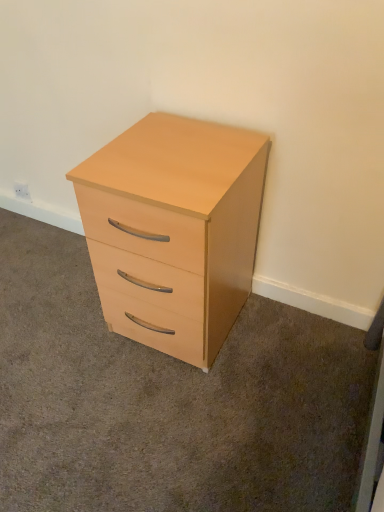
In order to face white plastic electric outlet at upper left, should I rotate leftwards or rightwards?

You should rotate left by 21.976 degrees.

Based on the photo, measure the distance between point (20, 195) and camera.

They are 2.01 meters apart.

Locate an element on the screen. white plastic electric outlet at upper left is located at coordinates (22, 191).

Describe the element at coordinates (22, 191) in the screenshot. I see `white plastic electric outlet at upper left` at that location.

The height and width of the screenshot is (512, 384). Describe the element at coordinates (174, 230) in the screenshot. I see `light wood/finish chest of drawers at center` at that location.

Locate an element on the screen. This screenshot has width=384, height=512. light wood/finish chest of drawers at center is located at coordinates (174, 230).

You are a GUI agent. You are given a task and a screenshot of the screen. Output one action in this format:
    pyautogui.click(x=<x>, y=<y>)
    Task: Click on the white plastic electric outlet at upper left
    The height and width of the screenshot is (512, 384).
    Given the screenshot: What is the action you would take?
    pyautogui.click(x=22, y=191)

Does white plastic electric outlet at upper left appear on the right side of light wood/finish chest of drawers at center?

In fact, white plastic electric outlet at upper left is to the left of light wood/finish chest of drawers at center.

Relative to light wood/finish chest of drawers at center, is white plastic electric outlet at upper left in front or behind?

white plastic electric outlet at upper left is positioned farther from the viewer than light wood/finish chest of drawers at center.

Is point (26, 199) less distant than point (163, 142)?

No, it is not.

From the image's perspective, between white plastic electric outlet at upper left and light wood/finish chest of drawers at center, who is located below?

light wood/finish chest of drawers at center, from the image's perspective.

From a real-world perspective, is white plastic electric outlet at upper left positioned above or below light wood/finish chest of drawers at center?

white plastic electric outlet at upper left is situated lower than light wood/finish chest of drawers at center in the real world.

Considering the relative sizes of white plastic electric outlet at upper left and light wood/finish chest of drawers at center in the image provided, is white plastic electric outlet at upper left wider than light wood/finish chest of drawers at center?

In fact, white plastic electric outlet at upper left might be narrower than light wood/finish chest of drawers at center.

Between white plastic electric outlet at upper left and light wood/finish chest of drawers at center, which one has less height?

white plastic electric outlet at upper left is shorter.

In terms of size, does white plastic electric outlet at upper left appear bigger or smaller than light wood/finish chest of drawers at center?

white plastic electric outlet at upper left is smaller than light wood/finish chest of drawers at center.

Is white plastic electric outlet at upper left completely or partially outside of light wood/finish chest of drawers at center?

Indeed, white plastic electric outlet at upper left is completely outside light wood/finish chest of drawers at center.

Is white plastic electric outlet at upper left not near light wood/finish chest of drawers at center?

Yes, white plastic electric outlet at upper left and light wood/finish chest of drawers at center are quite far apart.

Is white plastic electric outlet at upper left oriented towards light wood/finish chest of drawers at center?

No, white plastic electric outlet at upper left is not aimed at light wood/finish chest of drawers at center.

How far apart are white plastic electric outlet at upper left and light wood/finish chest of drawers at center?

white plastic electric outlet at upper left and light wood/finish chest of drawers at center are 3.56 feet apart.

Find the location of a particular element. Image resolution: width=384 pixels, height=512 pixels. electric outlet below the light wood/finish chest of drawers at center (from a real-world perspective) is located at coordinates pyautogui.click(x=22, y=191).

Can you confirm if light wood/finish chest of drawers at center is positioned to the right of white plastic electric outlet at upper left?

Yes.

Considering the relative positions of light wood/finish chest of drawers at center and white plastic electric outlet at upper left in the image provided, is light wood/finish chest of drawers at center in front of white plastic electric outlet at upper left?

That is True.

Which point is more forward, (98, 177) or (22, 182)?

Positioned in front is point (98, 177).

From the image's perspective, is light wood/finish chest of drawers at center located above white plastic electric outlet at upper left?

Actually, light wood/finish chest of drawers at center appears below white plastic electric outlet at upper left in the image.

From a real-world perspective, is light wood/finish chest of drawers at center physically below white plastic electric outlet at upper left?

No, from a real-world perspective, light wood/finish chest of drawers at center is not below white plastic electric outlet at upper left.

Is light wood/finish chest of drawers at center wider or thinner than white plastic electric outlet at upper left?

In the image, light wood/finish chest of drawers at center appears to be wider than white plastic electric outlet at upper left.

Is light wood/finish chest of drawers at center shorter than white plastic electric outlet at upper left?

No, light wood/finish chest of drawers at center is not shorter than white plastic electric outlet at upper left.

Does light wood/finish chest of drawers at center have a larger size compared to white plastic electric outlet at upper left?

Correct, light wood/finish chest of drawers at center is larger in size than white plastic electric outlet at upper left.

Is light wood/finish chest of drawers at center situated inside white plastic electric outlet at upper left or outside?

light wood/finish chest of drawers at center lies outside white plastic electric outlet at upper left.

Are light wood/finish chest of drawers at center and white plastic electric outlet at upper left located far from each other?

Yes.

From the picture: Is light wood/finish chest of drawers at center looking in the opposite direction of white plastic electric outlet at upper left?

No, light wood/finish chest of drawers at center is not facing away from white plastic electric outlet at upper left.

Where is `electric outlet behind the light wood/finish chest of drawers at center`? electric outlet behind the light wood/finish chest of drawers at center is located at coordinates (22, 191).

I want to click on chest of drawers above the white plastic electric outlet at upper left (from a real-world perspective), so click(174, 230).

Where is `electric outlet below the light wood/finish chest of drawers at center (from a real-world perspective)`? The width and height of the screenshot is (384, 512). electric outlet below the light wood/finish chest of drawers at center (from a real-world perspective) is located at coordinates (22, 191).